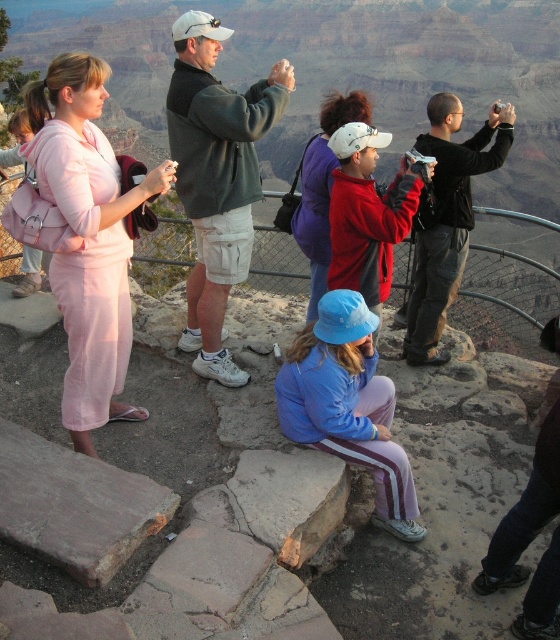
Which is more to the left, blue fabric jacket at center or matte red jacket at center?

blue fabric jacket at center

Which is in front, point (361, 392) or point (314, 198)?

Point (361, 392) is more forward.

The image size is (560, 640). Identify the location of blue fabric jacket at center. (348, 404).

Image resolution: width=560 pixels, height=640 pixels. Identify the location of blue fabric jacket at center. (348, 404).

Is pink fabric dress at left thinner than matte red jacket at center?

Yes, pink fabric dress at left is thinner than matte red jacket at center.

Does pink fabric dress at left have a greater width compared to matte red jacket at center?

No, pink fabric dress at left is not wider than matte red jacket at center.

The image size is (560, 640). Describe the element at coordinates (87, 237) in the screenshot. I see `pink fabric dress at left` at that location.

Identify the location of pink fabric dress at left. (87, 237).

Does pink fabric dress at left have a greater width compared to blue fabric jacket at center?

Yes.

Between pink fabric dress at left and blue fabric jacket at center, which one is positioned higher?

pink fabric dress at left is above.

Locate an element on the screen. Image resolution: width=560 pixels, height=640 pixels. pink fabric dress at left is located at coordinates (87, 237).